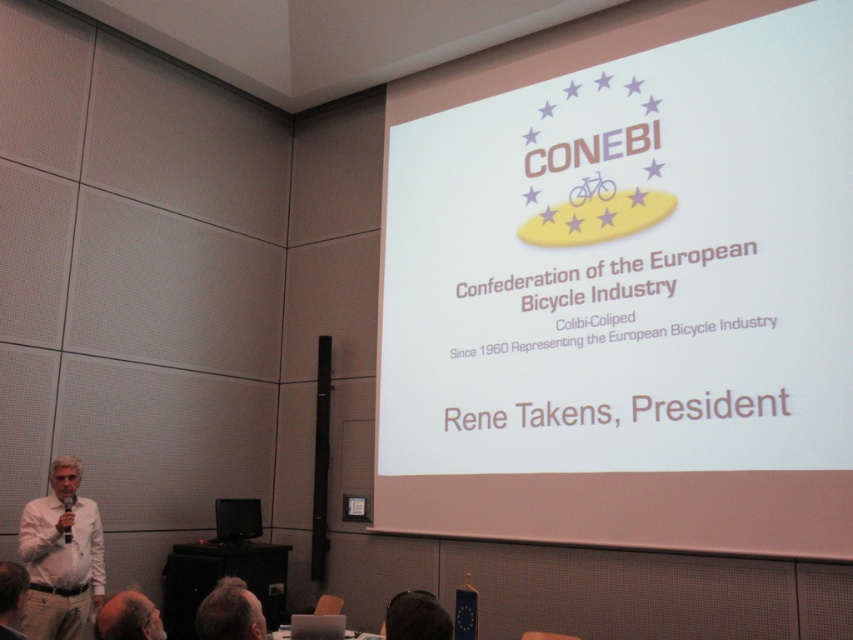
From the picture: Who is more distant from viewer, (257,627) or (405,616)?

Positioned behind is point (257,627).

Is point (215, 586) positioned in front of point (426, 593)?

No, it is behind (426, 593).

Locate an element on the screen. This screenshot has height=640, width=853. gray hair at lower left is located at coordinates (230, 612).

Is dark brown hair at lower center wider than light brown hair at lower left?

Yes, dark brown hair at lower center is wider than light brown hair at lower left.

This screenshot has width=853, height=640. Find the location of `dark brown hair at lower center`. dark brown hair at lower center is located at coordinates (416, 618).

Locate an element on the screen. dark brown hair at lower center is located at coordinates (416, 618).

How much distance is there between white paper at upper center and dark brown hair at lower center?

A distance of 3.17 meters exists between white paper at upper center and dark brown hair at lower center.

Does white paper at upper center appear on the left side of dark brown hair at lower center?

In fact, white paper at upper center is to the right of dark brown hair at lower center.

Locate an element on the screen. Image resolution: width=853 pixels, height=640 pixels. white paper at upper center is located at coordinates (625, 285).